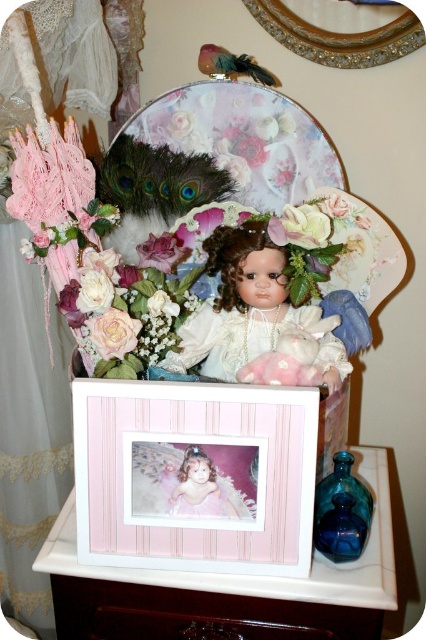
Question: Is matte pink rose at center above pink silk flower at center?

Choices:
 (A) no
 (B) yes

Answer: (A)

Question: Does floral bouquet at upper center appear over pink wood frame at center?

Choices:
 (A) yes
 (B) no

Answer: (A)

Question: Which object is closer to the camera taking this photo?

Choices:
 (A) pink wood frame at center
 (B) matte pink rose at center
 (C) pink wood picture frame at center
 (D) porcelain doll at center

Answer: (C)

Question: Among these objects, which one is nearest to the camera?

Choices:
 (A) pink wood frame at center
 (B) matte pink rose at center

Answer: (A)

Question: From the image, what is the correct spatial relationship of floral bouquet at upper center in relation to porcelain doll at center?

Choices:
 (A) above
 (B) below

Answer: (A)

Question: Which object appears farthest from the camera in this image?

Choices:
 (A) porcelain doll at center
 (B) pink wood frame at center
 (C) pink wood picture frame at center
 (D) pink silk flower at center

Answer: (D)